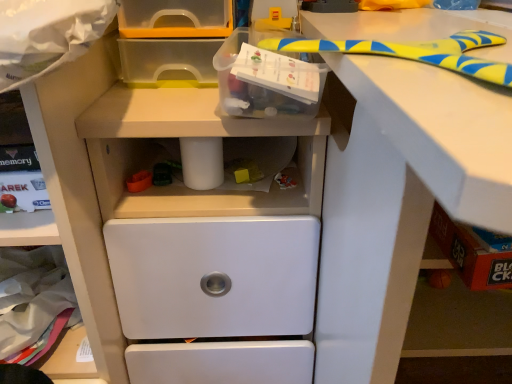
Measure the distance between point [226,326] and camera.

Point [226,326] and camera are 28.70 inches apart.

Measure the distance between white plastic workbench at center and camera.

The distance of white plastic workbench at center from camera is 21.62 inches.

Find the location of `white plastic drawer at lower center`. white plastic drawer at lower center is located at coordinates (x=70, y=229).

The image size is (512, 384). In order to click on translucent plastic box at upper center in this screenshot , I will do `click(267, 78)`.

Relative to white plastic drawer at lower center, is translucent plastic box at upper center in front or behind?

Visually, translucent plastic box at upper center is located in front of white plastic drawer at lower center.

The width and height of the screenshot is (512, 384). I want to click on shelf below the translucent plastic box at upper center (from the image's perspective), so click(x=70, y=229).

Between translucent plastic box at upper center and white plastic drawer at lower center, which one appears on the right side from the viewer's perspective?

translucent plastic box at upper center.

From a real-world perspective, is translucent plastic box at upper center on top of white plastic drawer at lower center?

Correct, in the physical world, translucent plastic box at upper center is higher than white plastic drawer at lower center.

Would you say white plastic drawer at lower center is inside or outside white plastic workbench at center?

white plastic drawer at lower center is spatially situated outside white plastic workbench at center.

Is the depth of white plastic drawer at lower center greater than that of white plastic workbench at center?

Yes, white plastic drawer at lower center is behind white plastic workbench at center.

From the image's perspective, does white plastic drawer at lower center appear lower than white plastic workbench at center?

Indeed, from the image's perspective, white plastic drawer at lower center is shown beneath white plastic workbench at center.

Is white plastic workbench at center next to translucent plastic box at upper center and touching it?

They are not placed beside each other.

Based on the photo, is white plastic workbench at center not inside translucent plastic box at upper center?

Absolutely, white plastic workbench at center is external to translucent plastic box at upper center.

From the image's perspective, between white plastic workbench at center and translucent plastic box at upper center, which one is located above?

translucent plastic box at upper center, from the image's perspective.

Where is `box on the right side of white plastic workbench at center`? box on the right side of white plastic workbench at center is located at coordinates pos(267,78).

In terms of size, does white plastic workbench at center appear bigger or smaller than white plastic drawer at lower center?

Considering their sizes, white plastic workbench at center takes up more space than white plastic drawer at lower center.

Is white plastic workbench at center further to the viewer compared to white plastic drawer at lower center?

No, it is not.

Which object is thinner, white plastic workbench at center or white plastic drawer at lower center?

With smaller width is white plastic drawer at lower center.

How far apart are white plastic drawer at lower center and translucent plastic box at upper center?

11.14 inches.

Is white plastic drawer at lower center shorter than translucent plastic box at upper center?

No, white plastic drawer at lower center is not shorter than translucent plastic box at upper center.

Is white plastic drawer at lower center located outside translucent plastic box at upper center?

Yes, white plastic drawer at lower center is located beyond the bounds of translucent plastic box at upper center.

Does white plastic drawer at lower center have a lesser width compared to translucent plastic box at upper center?

In fact, white plastic drawer at lower center might be wider than translucent plastic box at upper center.

Is translucent plastic box at upper center not near white plastic workbench at center?

No.

Is white plastic workbench at center a part of translucent plastic box at upper center?

No, white plastic workbench at center is located outside of translucent plastic box at upper center.

Considering the sizes of translucent plastic box at upper center and white plastic workbench at center in the image, is translucent plastic box at upper center bigger or smaller than white plastic workbench at center?

Considering their sizes, translucent plastic box at upper center takes up less space than white plastic workbench at center.

How different are the orientations of translucent plastic box at upper center and white plastic workbench at center in degrees?

They differ by 0.641 degrees in their facing directions.

Where is `box on the right of white plastic drawer at lower center`? This screenshot has width=512, height=384. box on the right of white plastic drawer at lower center is located at coordinates (267, 78).

Image resolution: width=512 pixels, height=384 pixels. Find the location of `shelf lying below the white plastic workbench at center (from the image's perspective)`. shelf lying below the white plastic workbench at center (from the image's perspective) is located at coordinates (70, 229).

Based on their spatial positions, is white plastic drawer at lower center or translucent plastic box at upper center further from white plastic workbench at center?

translucent plastic box at upper center is positioned further to the anchor white plastic workbench at center.

From the image, which object appears to be nearer to translucent plastic box at upper center, white plastic workbench at center or white plastic drawer at lower center?

Among the two, white plastic workbench at center is located nearer to translucent plastic box at upper center.

Based on their spatial positions, is translucent plastic box at upper center or white plastic drawer at lower center further from white plastic workbench at center?

translucent plastic box at upper center lies further to white plastic workbench at center than the other object.

Looking at the image, which one is located closer to white plastic drawer at lower center, white plastic workbench at center or translucent plastic box at upper center?

white plastic workbench at center.

Which object lies further to the anchor point translucent plastic box at upper center, white plastic drawer at lower center or white plastic workbench at center?

Among the two, white plastic drawer at lower center is located further to translucent plastic box at upper center.

Based on their spatial positions, is translucent plastic box at upper center or white plastic workbench at center closer to white plastic drawer at lower center?

The object closer to white plastic drawer at lower center is white plastic workbench at center.

I want to click on workbench located between white plastic drawer at lower center and translucent plastic box at upper center in the left-right direction, so click(x=204, y=223).